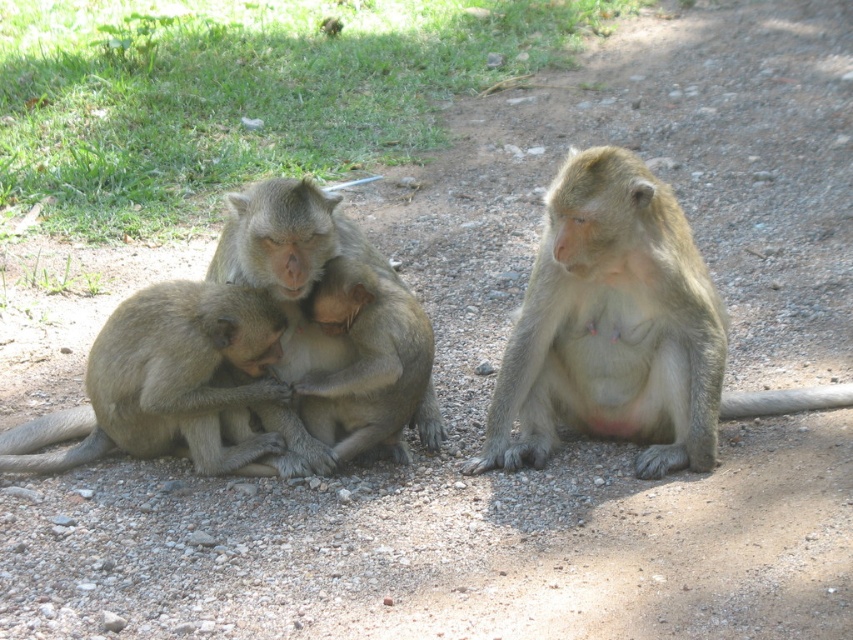
Question: Where is light brown fur monkey at center located in relation to light brown fur monkey at center left in the image?

Choices:
 (A) left
 (B) right

Answer: (B)

Question: Does light brown fur monkey at center come behind light brown fur monkey at center left?

Choices:
 (A) no
 (B) yes

Answer: (A)

Question: Which object is closer to the camera taking this photo?

Choices:
 (A) light brown fur monkey at center
 (B) brown fur monkey at center

Answer: (A)

Question: Which point is closer to the camera taking this photo?

Choices:
 (A) (170, 378)
 (B) (538, 259)
 (C) (328, 241)

Answer: (C)

Question: Is light brown fur monkey at center left smaller than brown fur monkey at center?

Choices:
 (A) yes
 (B) no

Answer: (B)

Question: Among these points, which one is nearest to the camera?

Choices:
 (A) (558, 385)
 (B) (235, 205)
 (C) (109, 429)

Answer: (B)